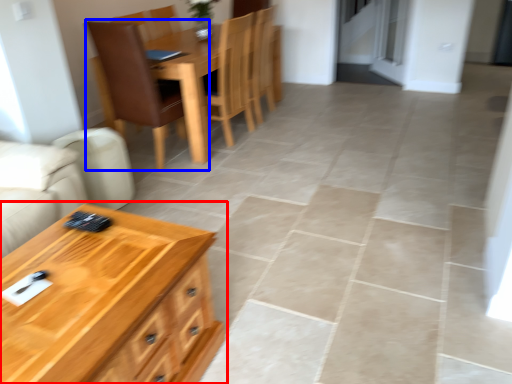
Question: Which object appears farthest to the camera in this image, table (highlighted by a red box) or chair (highlighted by a blue box)?

Choices:
 (A) table
 (B) chair

Answer: (B)